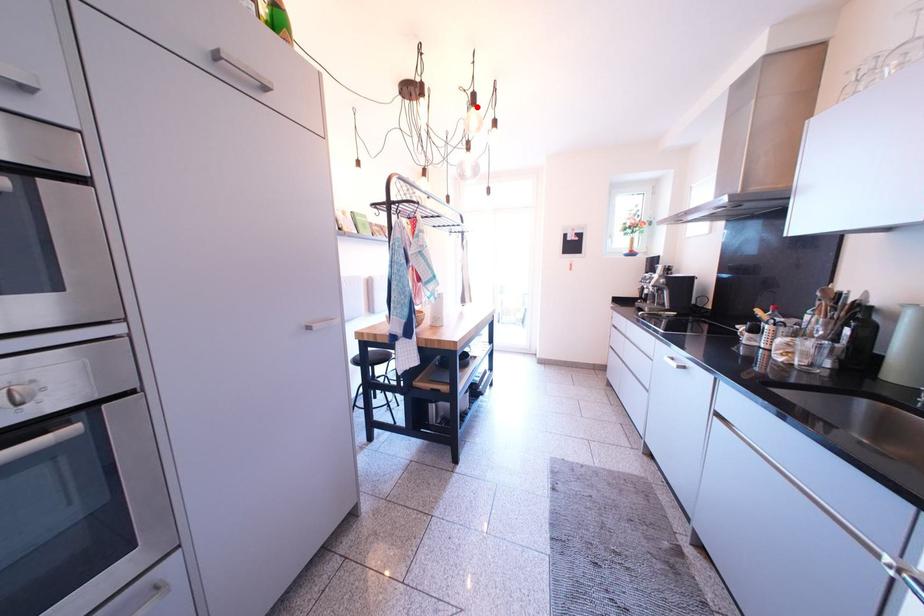
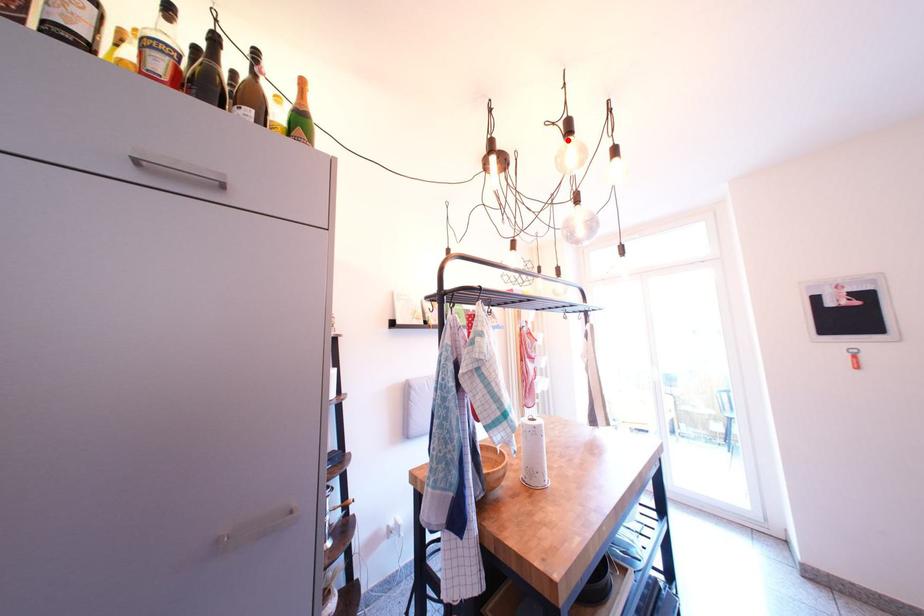
I am providing you with two images of the same scene from different viewpoints. A red point is marked on the first image and another point is marked on the second image. Is the marked point in image1 the same physical position as the marked point in image2?

Yes